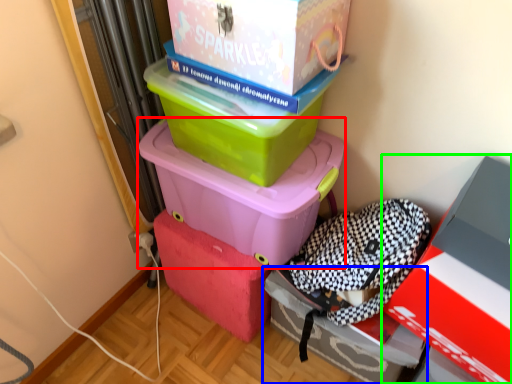
Question: Considering the real-world distances, which object is closest to box (highlighted by a red box)? box (highlighted by a blue box) or box (highlighted by a green box).

Choices:
 (A) box
 (B) box

Answer: (A)